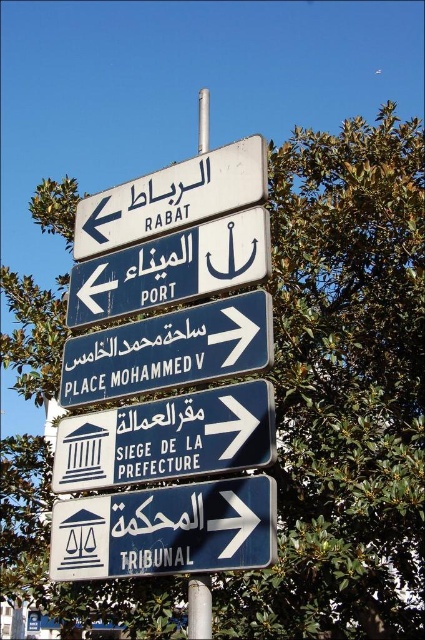
Who is shorter, blue metallic sign at center or white plastic sign at left?

white plastic sign at left is shorter.

Who is higher up, blue metallic sign at center or white plastic sign at left?

white plastic sign at left is higher up.

Between point (252, 333) and point (175, 244), which one is positioned behind?

The point (175, 244) is behind.

Where is `blue metallic sign at center`? This screenshot has height=640, width=425. blue metallic sign at center is located at coordinates (169, 349).

Does blue metallic sign at center-right appear over white plastic sign at left?

No.

Is blue metallic sign at center-right thinner than white plastic sign at left?

A: In fact, blue metallic sign at center-right might be wider than white plastic sign at left.

The height and width of the screenshot is (640, 425). Find the location of `blue metallic sign at center-right`. blue metallic sign at center-right is located at coordinates (167, 438).

Between blue metallic sign at lower right and white plastic sign at left, which one has less height?

With less height is white plastic sign at left.

Between point (169, 540) and point (265, 236), which one is positioned behind?

The point (265, 236) is more distant.

Describe the element at coordinates (166, 531) in the screenshot. Image resolution: width=425 pixels, height=640 pixels. I see `blue metallic sign at lower right` at that location.

Locate an element on the screen. blue metallic sign at lower right is located at coordinates (166, 531).